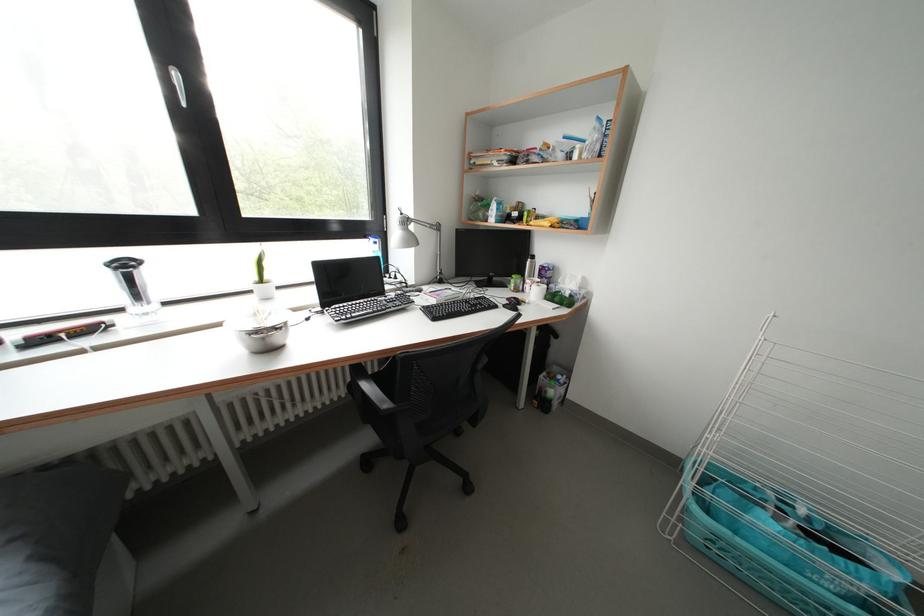
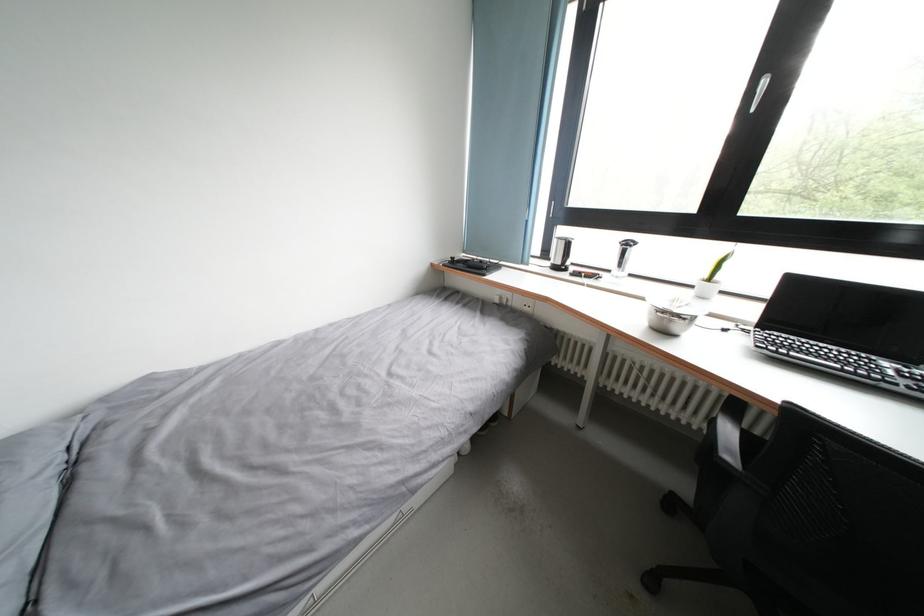
In the second image, find the point that corresponds to point (392, 410) in the first image.

(736, 462)